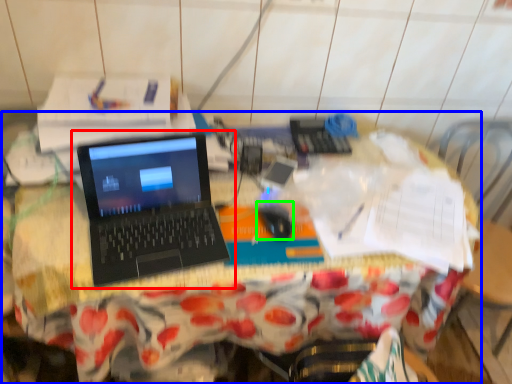
Question: Which object is the farthest from laptop (highlighted by a red box)? Choose among these: desk (highlighted by a blue box) or mouse (highlighted by a green box).

Choices:
 (A) desk
 (B) mouse

Answer: (B)